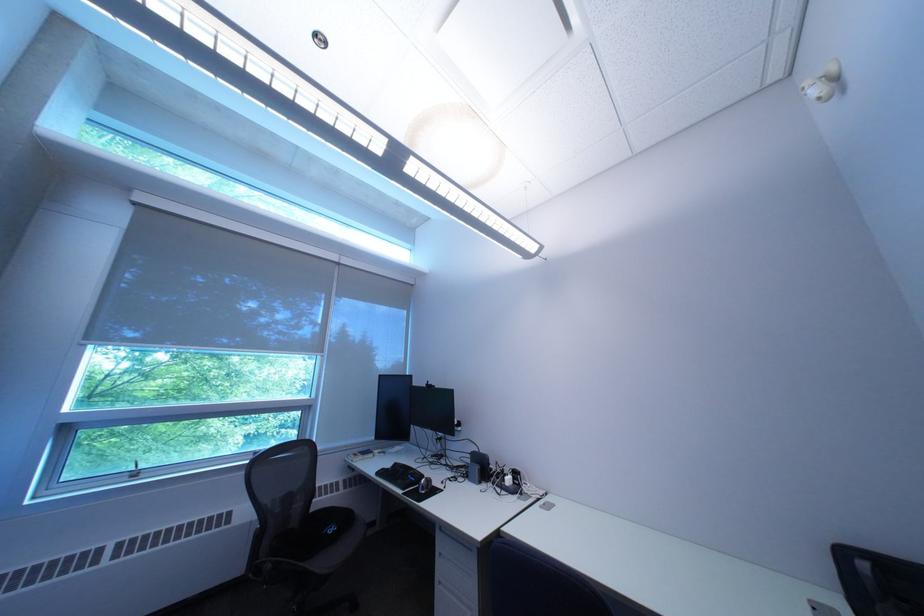
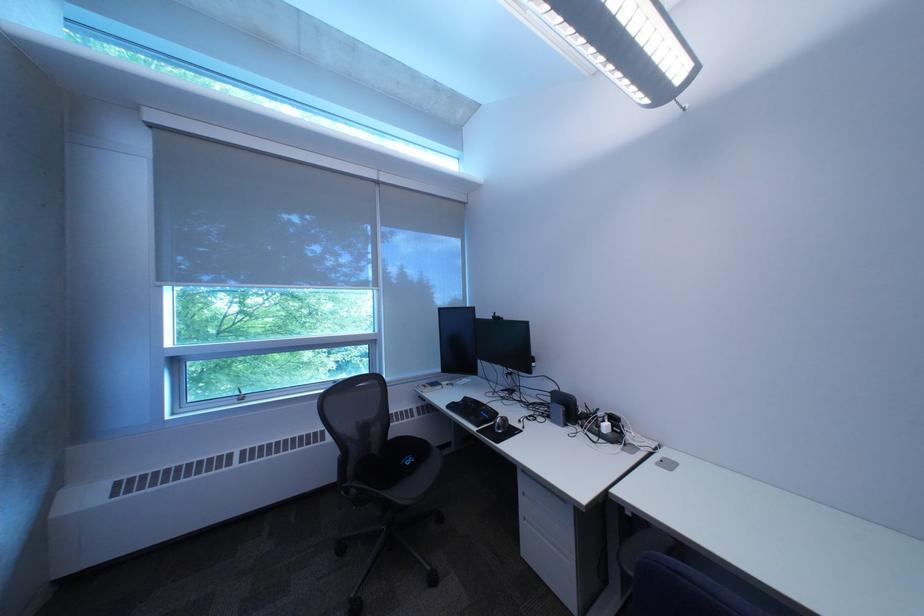
Locate, in the second image, the point that corresponds to point (346, 530) in the first image.

(423, 461)